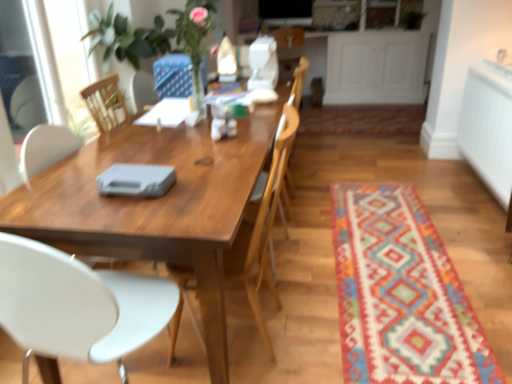
Identify the location of empty space that is to the right of wooden chair at center, acting as the 2th chair starting from the left. (320, 319).